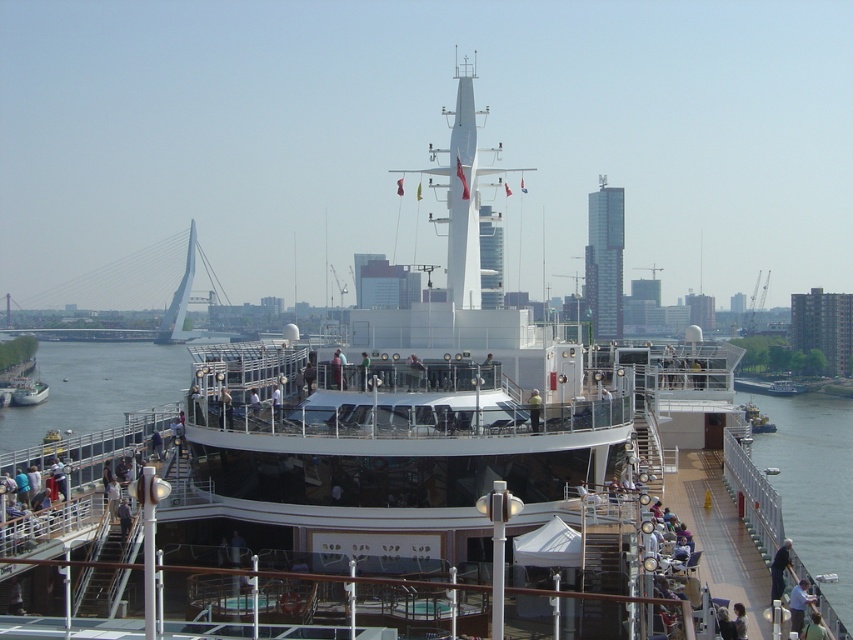
Which is more to the right, light brown leather jacket at lower right or yellow reflective vest at center?

light brown leather jacket at lower right is more to the right.

Describe the element at coordinates (799, 604) in the screenshot. The height and width of the screenshot is (640, 853). I see `light brown leather jacket at lower right` at that location.

Identify the location of light brown leather jacket at lower right. This screenshot has height=640, width=853. (799, 604).

Is dark blue fabric jacket at lower right bigger than yellow reflective vest at center?

No.

Image resolution: width=853 pixels, height=640 pixels. I want to click on dark blue fabric jacket at lower right, so click(x=779, y=570).

Can you confirm if green water at lower right is taller than dark blue fabric jacket at lower right?

Yes, green water at lower right is taller than dark blue fabric jacket at lower right.

Is point (776, 451) behind point (775, 579)?

Yes, it is behind point (775, 579).

At what (x,y) coordinates should I click in order to perform the action: click on green water at lower right. Please return your answer as a coordinate pair (x, y). The image size is (853, 640). Looking at the image, I should click on (813, 481).